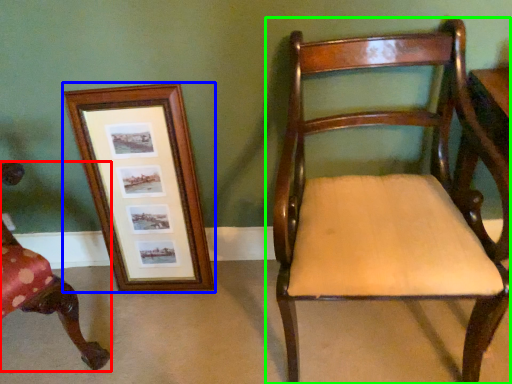
Question: Which object is positioned closest to chair (highlighted by a red box)? Select from picture frame (highlighted by a blue box) and chair (highlighted by a green box).

Choices:
 (A) picture frame
 (B) chair

Answer: (A)